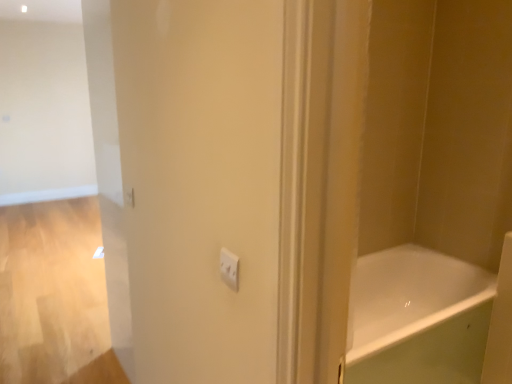
Question: Considering the positions of point (229, 256) and point (420, 274), is point (229, 256) closer or farther from the camera than point (420, 274)?

Choices:
 (A) closer
 (B) farther

Answer: (A)

Question: In the image, is white plastic light switch at center on the left side or the right side of white glossy bathtub at center?

Choices:
 (A) left
 (B) right

Answer: (A)

Question: Considering the positions of white plastic light switch at center and white glossy bathtub at center in the image, is white plastic light switch at center bigger or smaller than white glossy bathtub at center?

Choices:
 (A) big
 (B) small

Answer: (B)

Question: In terms of height, does white glossy bathtub at center look taller or shorter compared to white plastic light switch at center?

Choices:
 (A) short
 (B) tall

Answer: (B)

Question: Is point (441, 286) positioned closer to the camera than point (232, 289)?

Choices:
 (A) farther
 (B) closer

Answer: (A)

Question: From a real-world perspective, is white glossy bathtub at center above or below white plastic light switch at center?

Choices:
 (A) above
 (B) below

Answer: (B)

Question: Looking at their shapes, would you say white glossy bathtub at center is wider or thinner than white plastic light switch at center?

Choices:
 (A) wide
 (B) thin

Answer: (A)